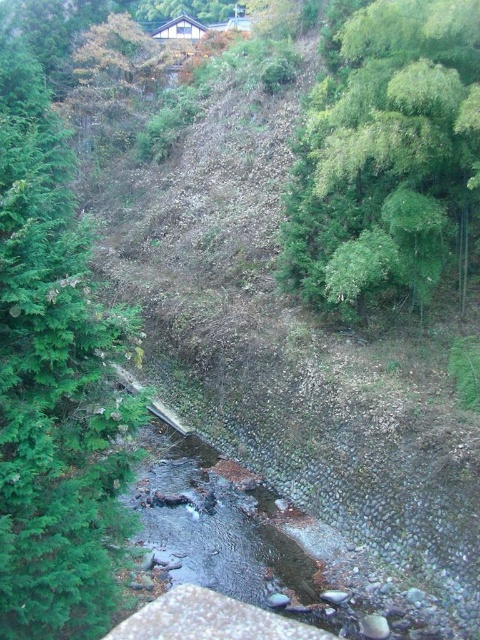
Based on the photo, which is below, green textured tree at left or green leafy tree at upper right?

green textured tree at left

Locate an element on the screen. green textured tree at left is located at coordinates (x=54, y=384).

I want to click on green textured tree at left, so click(x=54, y=384).

Where is `green textured tree at left`? The image size is (480, 640). green textured tree at left is located at coordinates (54, 384).